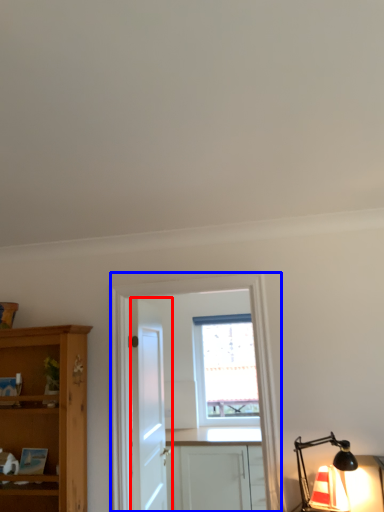
Question: Which point is further to the camera, door (highlighted by a red box) or entertainment center (highlighted by a blue box)?

Choices:
 (A) door
 (B) entertainment center

Answer: (A)